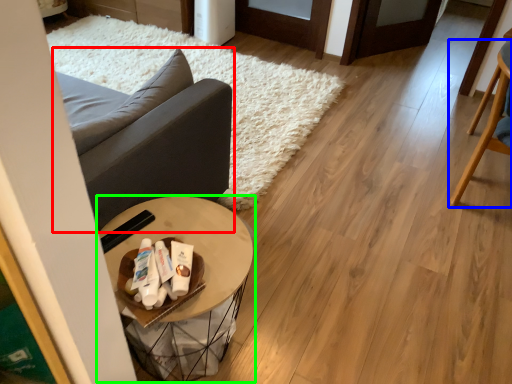
Question: Which object is positioned closest to studio couch (highlighted by a red box)? Select from chair (highlighted by a blue box) and table (highlighted by a green box).

Choices:
 (A) chair
 (B) table

Answer: (B)